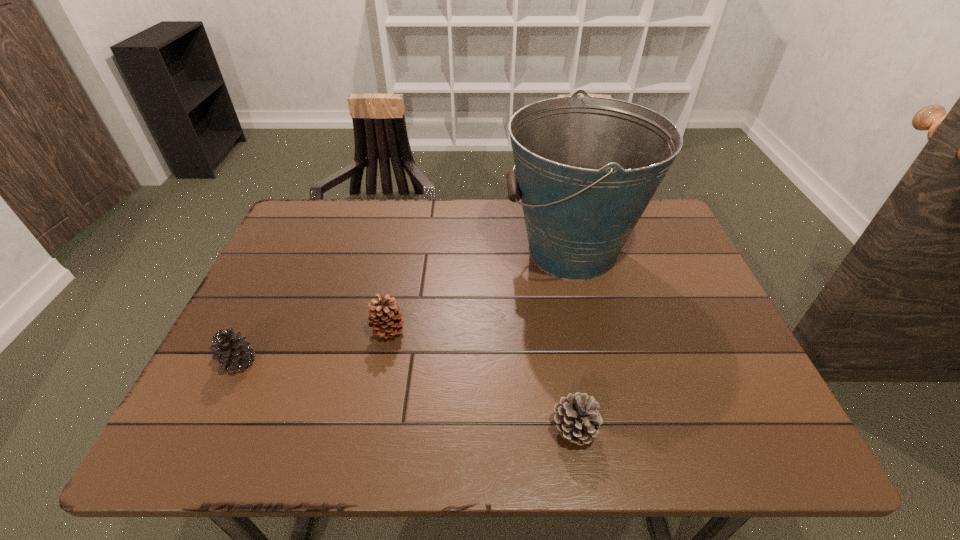
This screenshot has width=960, height=540. Identify the location of vacant space situated 0.160m with the handle on opposite sides of the tallest object. (445, 252).

At what (x,y) coordinates should I click in order to perform the action: click on free space located 0.210m on the back of the second pinecone from right to left. Please return your answer as a coordinate pair (x, y). The width and height of the screenshot is (960, 540). Looking at the image, I should click on (402, 260).

Identify the location of blank space located 0.110m on the front of the third farthest object. Image resolution: width=960 pixels, height=540 pixels. (208, 426).

Image resolution: width=960 pixels, height=540 pixels. Find the location of `vacant space located 0.240m on the left of the nearest object`. vacant space located 0.240m on the left of the nearest object is located at coordinates (425, 429).

Locate an element on the screen. The image size is (960, 540). object that is at the far edge is located at coordinates (586, 168).

The width and height of the screenshot is (960, 540). In order to click on object that is at the near edge in this screenshot , I will do `click(577, 419)`.

Find the location of a particular element. Image resolution: width=960 pixels, height=540 pixels. object present at the left edge is located at coordinates (233, 352).

The width and height of the screenshot is (960, 540). I want to click on object that is at the right edge, so click(586, 168).

Identify the location of object located in the far right corner section of the desktop. This screenshot has height=540, width=960. (586, 168).

In the image, there is a desktop. Identify the location of free region at the far edge. (359, 244).